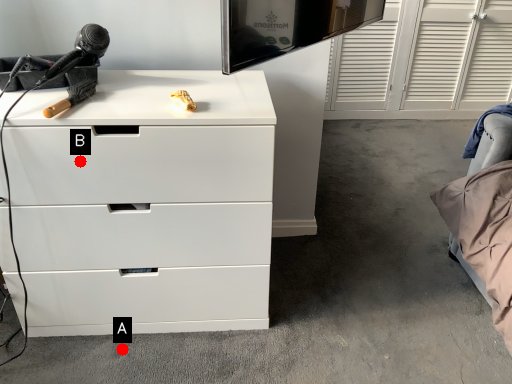
Question: Two points are circled on the image, labeled by A and B beside each circle. Which of the following is the farthest from the observer?

Choices:
 (A) A is further
 (B) B is further

Answer: (A)